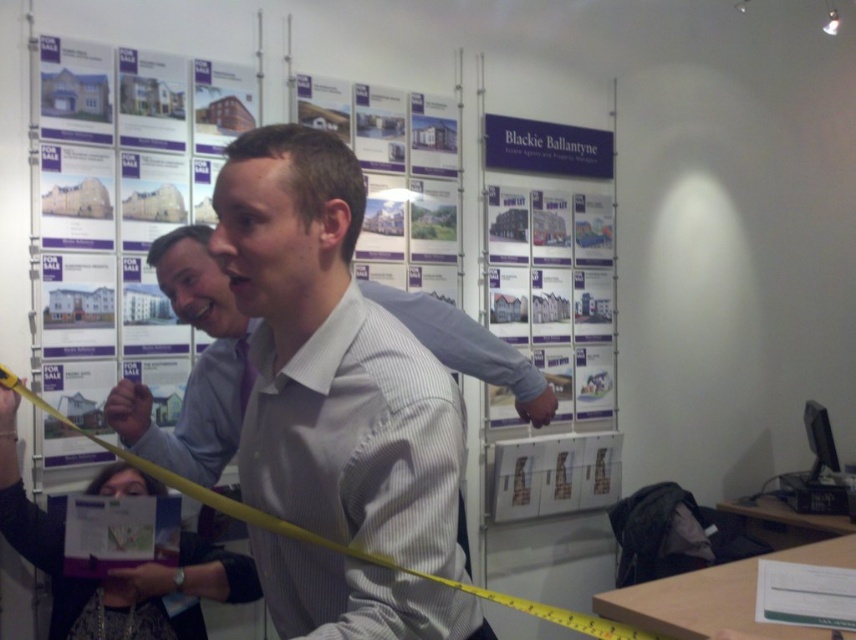
Question: Where is white shirt at center located in relation to white striped shirt at center in the image?

Choices:
 (A) below
 (B) above

Answer: (A)

Question: Which point appears farthest from the camera in this image?

Choices:
 (A) (201, 250)
 (B) (104, 480)

Answer: (B)

Question: Which of the following is the farthest from the observer?

Choices:
 (A) (141, 625)
 (B) (173, 257)

Answer: (A)

Question: Does white shirt at center appear over white striped shirt at center?

Choices:
 (A) no
 (B) yes

Answer: (A)

Question: Is white shirt at center below white striped shirt at center?

Choices:
 (A) no
 (B) yes

Answer: (B)

Question: Which point is farther to the camera?

Choices:
 (A) white striped shirt at center
 (B) white shirt at center

Answer: (A)